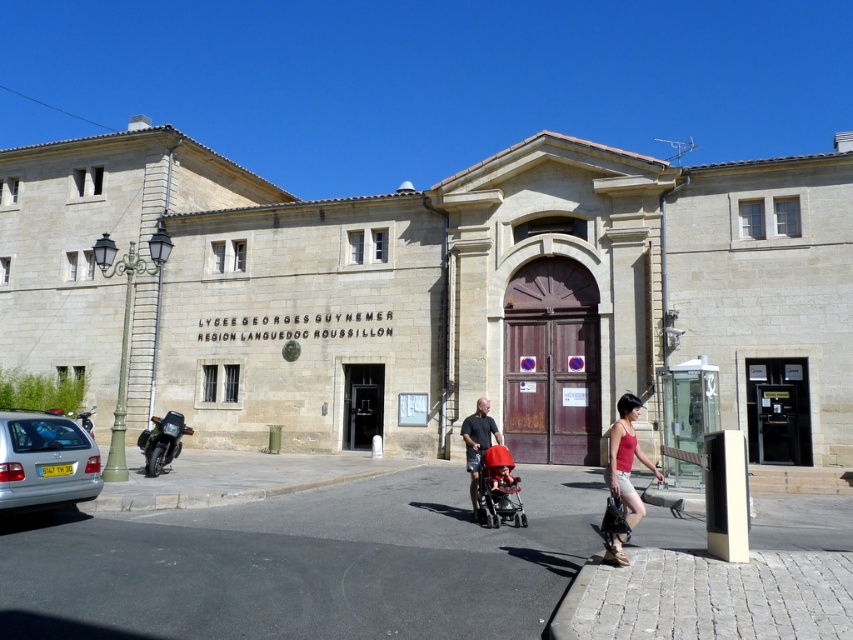
Does brick pavement at center have a greater width compared to shiny black motorcycle at lower left?

Yes.

Who is more forward, (158, 540) or (167, 412)?

Positioned in front is point (158, 540).

Is point (167, 600) in front of point (170, 428)?

Yes, it is.

Locate an element on the screen. Image resolution: width=853 pixels, height=640 pixels. brick pavement at center is located at coordinates (305, 564).

Does shiny black motorcycle at lower left appear on the left side of matte black shirt at center?

Correct, you'll find shiny black motorcycle at lower left to the left of matte black shirt at center.

Which is behind, point (190, 433) or point (483, 419)?

The point (190, 433) is more distant.

Where is `shiny black motorcycle at lower left`? This screenshot has width=853, height=640. shiny black motorcycle at lower left is located at coordinates (161, 442).

Does red plastic baby carriage at center have a smaller size compared to shiny black motorcycle at lower left?

Correct, red plastic baby carriage at center occupies less space than shiny black motorcycle at lower left.

Which is in front, point (479, 500) or point (155, 458)?

Positioned in front is point (479, 500).

At what (x,y) coordinates should I click in order to perform the action: click on red plastic baby carriage at center. Please return your answer as a coordinate pair (x, y). Looking at the image, I should click on (498, 490).

The height and width of the screenshot is (640, 853). What are the coordinates of `red plastic baby carriage at center` in the screenshot? It's located at 498,490.